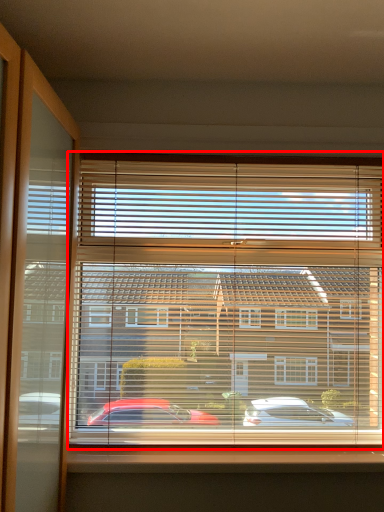
Question: From the image's perspective, where is window blind (annotated by the red box) located relative to window sill?

Choices:
 (A) below
 (B) above

Answer: (B)